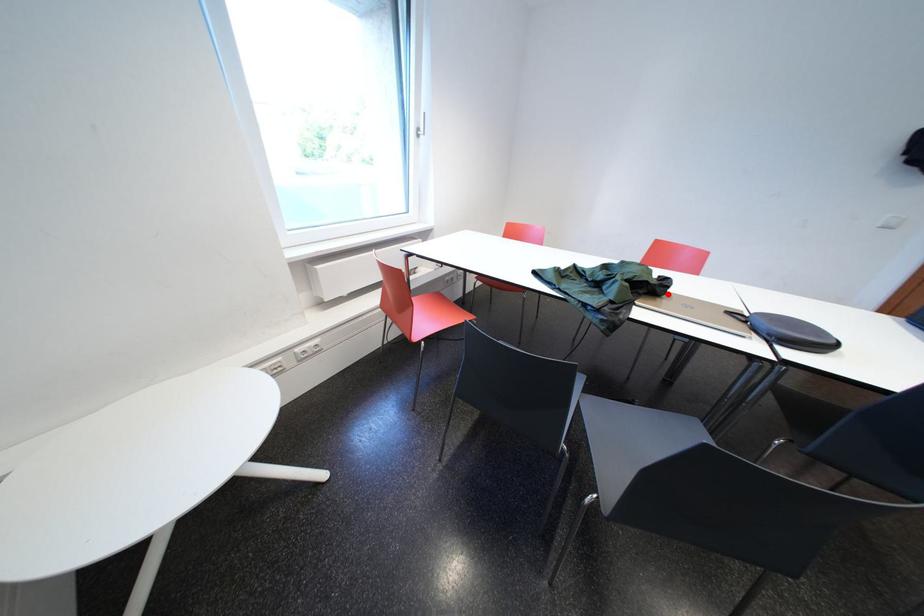
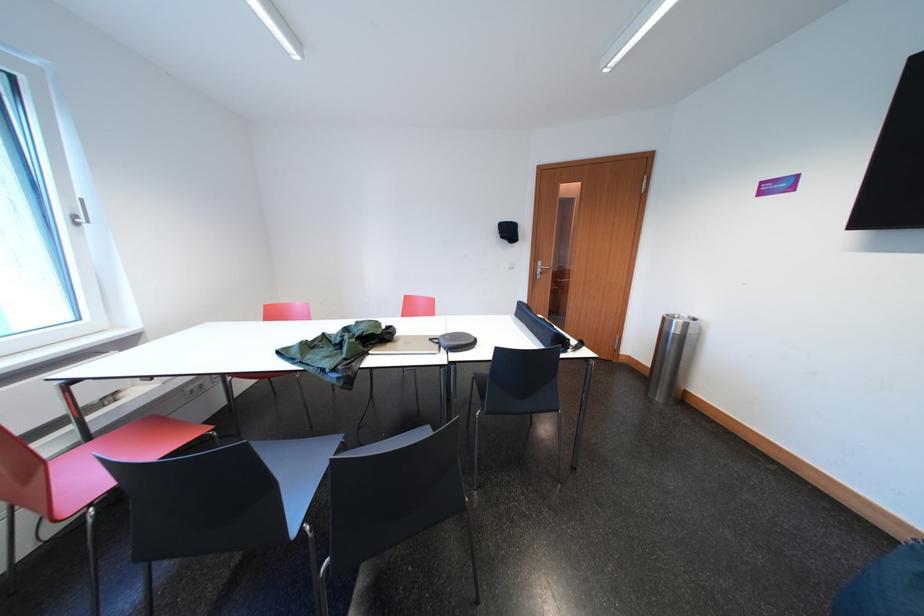
Locate, in the second image, the point that corresponds to the highlighted location in the first image.

(395, 341)